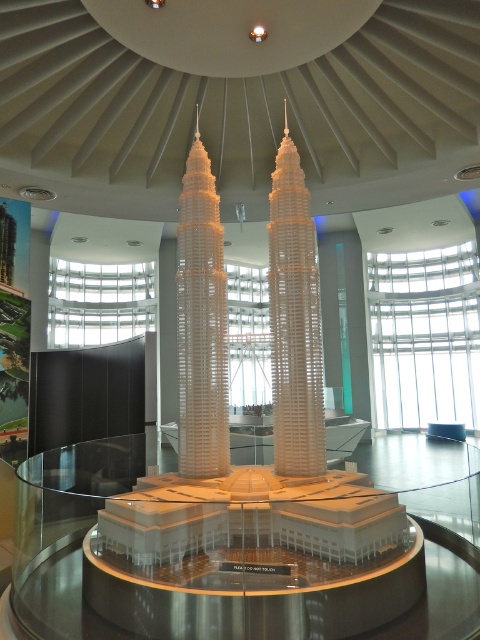
Question: Does white plastic tower at center come in front of white plastic building at center?

Choices:
 (A) no
 (B) yes

Answer: (B)

Question: Observing the image, what is the correct spatial positioning of white plastic tower at center in reference to white plastic building at center?

Choices:
 (A) below
 (B) above

Answer: (B)

Question: Does white plastic tower at center lie behind white plastic building at center?

Choices:
 (A) no
 (B) yes

Answer: (A)